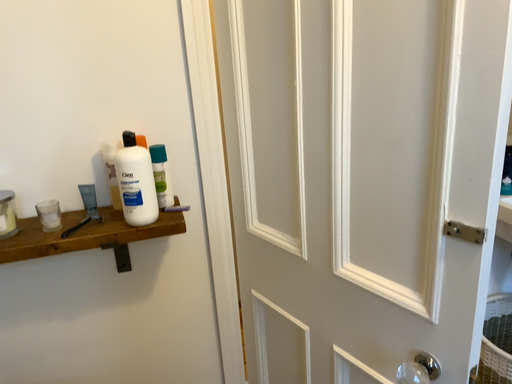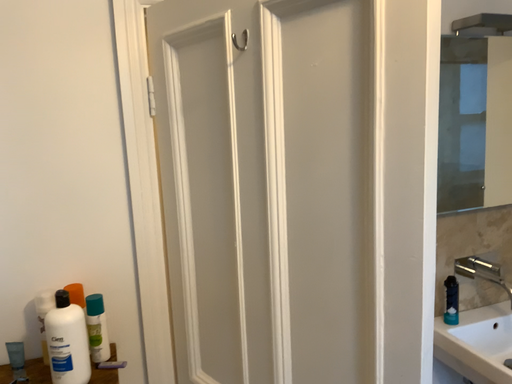
Question: Which way did the camera rotate in the video?

Choices:
 (A) rotated downward
 (B) rotated upward

Answer: (B)